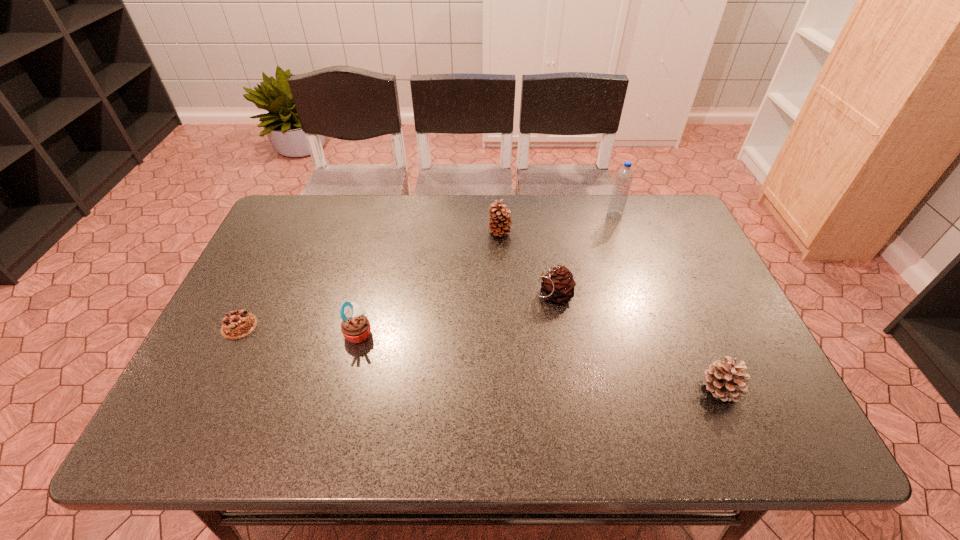
The height and width of the screenshot is (540, 960). I want to click on the fifth object from left to right, so click(x=624, y=176).

Where is `the tallest object`? This screenshot has height=540, width=960. the tallest object is located at coordinates (624, 176).

I want to click on the farthest pinecone, so click(500, 221).

I want to click on the fifth nearest object, so click(500, 221).

Find the location of a particular element. The width and height of the screenshot is (960, 540). muffin is located at coordinates (355, 327).

At what (x,y) coordinates should I click in order to perform the action: click on the third farthest object. Please return your answer as a coordinate pair (x, y). This screenshot has height=540, width=960. Looking at the image, I should click on (557, 285).

Find the location of a particular element. Image resolution: width=960 pixels, height=540 pixels. the second pinecone from right to left is located at coordinates (557, 285).

Locate an element on the screen. The image size is (960, 540). the rightmost pinecone is located at coordinates (725, 381).

You are a GUI agent. You are given a task and a screenshot of the screen. Output one action in this format:
    pyautogui.click(x=<x>, y=<y>)
    Task: Click on the nearest object
    
    Given the screenshot: What is the action you would take?
    pyautogui.click(x=725, y=381)

Find the location of a particular element. Image resolution: width=960 pixels, height=540 pixels. the leftmost object is located at coordinates (239, 323).